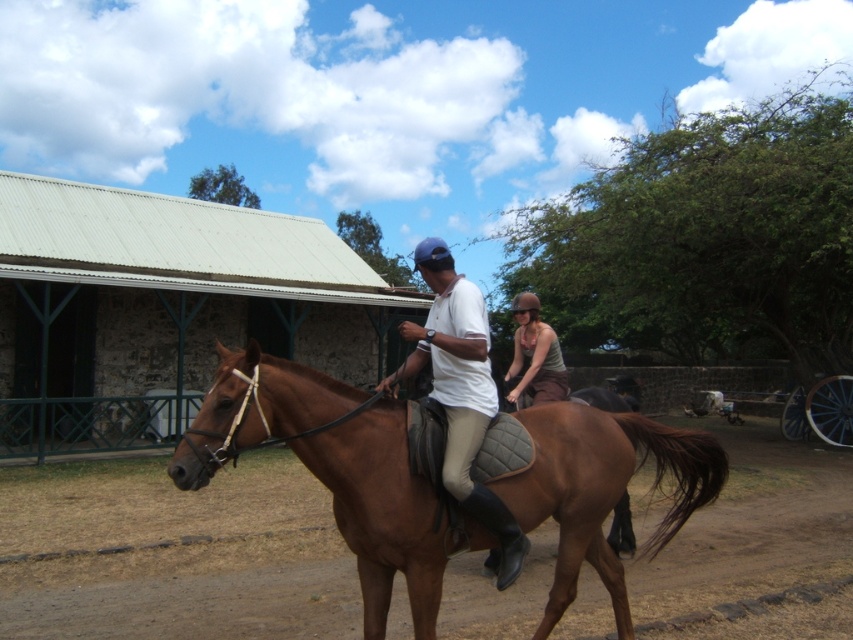
Can you confirm if brown glossy horse at center is positioned to the left of white matte shirt at center?

In fact, brown glossy horse at center is to the right of white matte shirt at center.

Which of these two, brown glossy horse at center or white matte shirt at center, stands shorter?

Standing shorter between the two is white matte shirt at center.

Find the location of a particular element. brown glossy horse at center is located at coordinates (329, 472).

Describe the element at coordinates (460, 392) in the screenshot. This screenshot has height=640, width=853. I see `white matte shirt at center` at that location.

Between white matte shirt at center and matte brown helmet at center, which one is positioned higher?

white matte shirt at center is above.

Find the location of a particular element. This screenshot has height=640, width=853. white matte shirt at center is located at coordinates (460, 392).

Image resolution: width=853 pixels, height=640 pixels. What are the coordinates of `white matte shirt at center` in the screenshot? It's located at (460, 392).

Between brown glossy horse at center and matte brown helmet at center, which one is positioned higher?

matte brown helmet at center is above.

Who is taller, brown glossy horse at center or matte brown helmet at center?

Standing taller between the two is brown glossy horse at center.

Locate an element on the screen. This screenshot has height=640, width=853. brown glossy horse at center is located at coordinates (329, 472).

The height and width of the screenshot is (640, 853). What are the coordinates of `brown glossy horse at center` in the screenshot? It's located at (329, 472).